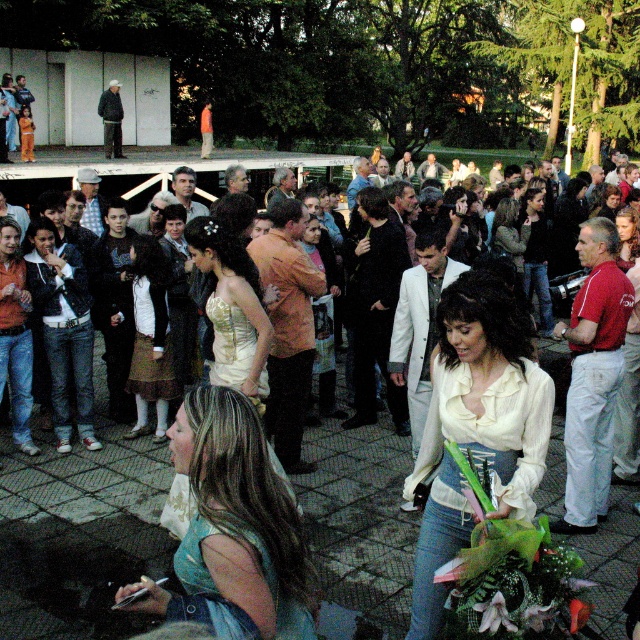
Question: Is white satin blouse at center to the right of blue denim dress at lower center from the viewer's perspective?

Choices:
 (A) no
 (B) yes

Answer: (B)

Question: Which point is farther from the camera taking this photo?

Choices:
 (A) (250, 417)
 (B) (257, 408)
 (C) (432, 634)

Answer: (B)

Question: Considering the real-world distances, which object is farthest from the blue denim dress at lower center?

Choices:
 (A) white satin blouse at center
 (B) matte gold dress at center

Answer: (B)

Question: Considering the relative positions of blue denim dress at lower center and matte gold dress at center in the image provided, where is blue denim dress at lower center located with respect to matte gold dress at center?

Choices:
 (A) right
 (B) left

Answer: (A)

Question: Can you confirm if white satin blouse at center is bigger than matte gold dress at center?

Choices:
 (A) no
 (B) yes

Answer: (B)

Question: Which of the following is the closest to the observer?

Choices:
 (A) (468, 284)
 (B) (241, 522)
 (C) (230, 256)

Answer: (B)